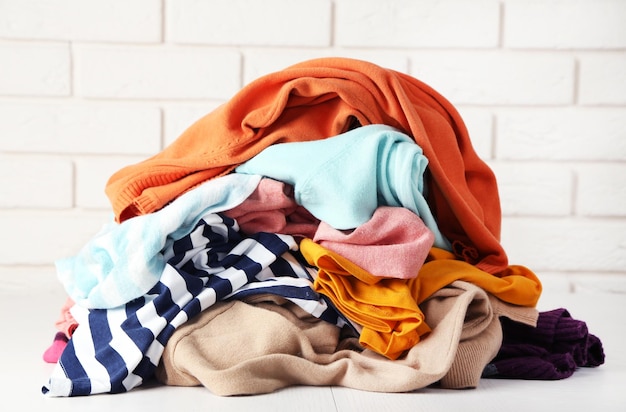
This screenshot has height=412, width=626. Identify the location of pile of cloths. (308, 79), (339, 156), (275, 189), (349, 287), (459, 306), (541, 337), (237, 262), (163, 220), (54, 339), (66, 325).